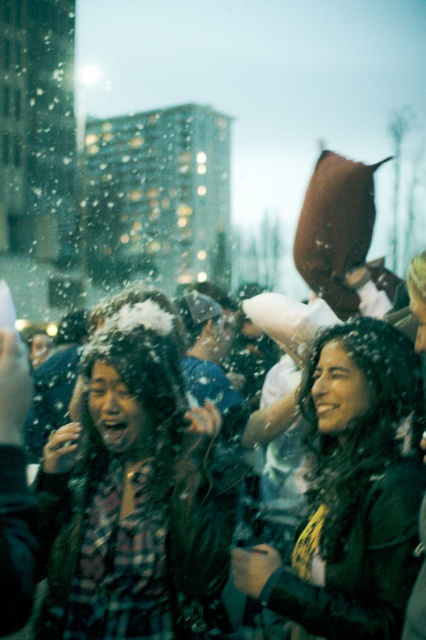
Question: Can you confirm if plaid fabric scarf at center is smaller than shiny black jacket at center?

Choices:
 (A) yes
 (B) no

Answer: (B)

Question: Is plaid fabric scarf at center wider than shiny black jacket at center?

Choices:
 (A) no
 (B) yes

Answer: (B)

Question: Which object appears closest to the camera in this image?

Choices:
 (A) shiny black jacket at center
 (B) plaid fabric scarf at center

Answer: (A)

Question: Is plaid fabric scarf at center positioned at the back of shiny black jacket at center?

Choices:
 (A) yes
 (B) no

Answer: (A)